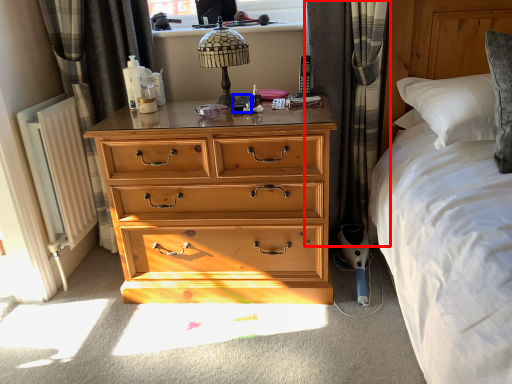
Question: Which object appears farthest to the camera in this image, curtain (highlighted by a red box) or remote control (highlighted by a blue box)?

Choices:
 (A) curtain
 (B) remote control

Answer: (B)